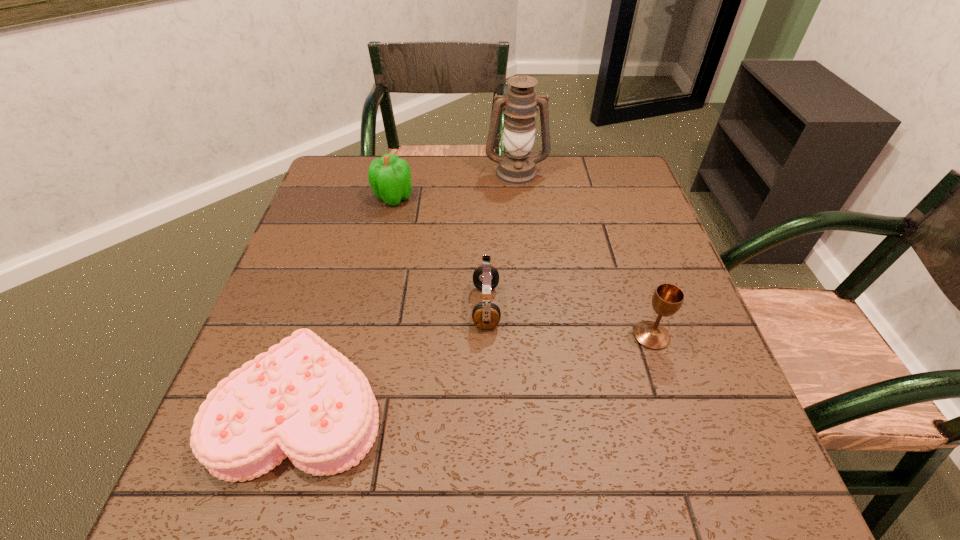
Locate an element on the screen. The height and width of the screenshot is (540, 960). free space located 0.320m on the ear cups of the headset is located at coordinates (324, 307).

Find the location of a particular element. This screenshot has width=960, height=540. vacant point located 0.380m on the ear cups of the headset is located at coordinates (297, 307).

You are a GUI agent. You are given a task and a screenshot of the screen. Output one action in this format:
    pyautogui.click(x=<x>, y=<y>)
    Task: Click on the free point located 0.280m on the back of the cake
    The image size is (960, 540).
    Given the screenshot: What is the action you would take?
    pyautogui.click(x=349, y=251)

Image resolution: width=960 pixels, height=540 pixels. Identify the location of oil lamp that is at the far edge. (516, 167).

Identify the location of bell pepper at the far edge. The height and width of the screenshot is (540, 960). (389, 176).

Image resolution: width=960 pixels, height=540 pixels. Find the location of `object positioned at the near edge`. object positioned at the near edge is located at coordinates [303, 399].

Where is `bell pepper present at the left edge`? Image resolution: width=960 pixels, height=540 pixels. bell pepper present at the left edge is located at coordinates (389, 176).

The width and height of the screenshot is (960, 540). What are the coordinates of `cake located in the left edge section of the desktop` in the screenshot? It's located at (303, 399).

The image size is (960, 540). I want to click on object positioned at the right edge, so click(x=667, y=299).

What are the coordinates of `object at the far left corner` in the screenshot? It's located at (389, 176).